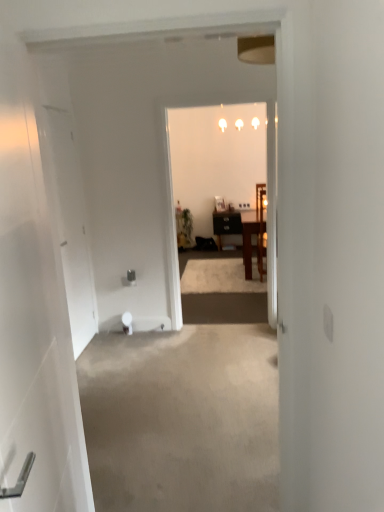
Identify the location of white matte door at left, the 2th door positioned from the front. [69, 202].

Measure the distance between point (17, 46) and camera.

They are 4.37 feet apart.

At what (x,y) coordinates should I click in order to perform the action: click on wooden chair at center, the 2th chair positioned from the back. Please return your answer as a coordinate pair (x, y). This screenshot has width=384, height=512. Looking at the image, I should click on (261, 228).

Image resolution: width=384 pixels, height=512 pixels. What do you see at coordinates (184, 228) in the screenshot?
I see `green matte houseplant at center` at bounding box center [184, 228].

Find the location of a particular element. This screenshot has height=512, width=384. white matte door at left, the second door in the right-to-left sequence is located at coordinates (69, 202).

Does green matte houseplant at center have a greater width compared to wooden chair at center, the 2th chair positioned from the back?

No, green matte houseplant at center is not wider than wooden chair at center, the 2th chair positioned from the back.

From a real-world perspective, which object rests below the other?

green matte houseplant at center, from a real-world perspective.

Considering the relative sizes of green matte houseplant at center and wooden chair at center, the first chair from the front, in the image provided, is green matte houseplant at center bigger than wooden chair at center, the first chair from the front,?

Incorrect, green matte houseplant at center is not larger than wooden chair at center, the first chair from the front.

From the picture: Which object is closer to the camera, green matte houseplant at center or wooden chair at center, the 2th chair positioned from the back?

wooden chair at center, the 2th chair positioned from the back, is in front.

Can we say green matte houseplant at center lies outside white glossy light fixture at upper center?

Yes, green matte houseplant at center is not within white glossy light fixture at upper center.

Considering the sizes of objects green matte houseplant at center and white glossy light fixture at upper center in the image provided, who is shorter, green matte houseplant at center or white glossy light fixture at upper center?

Standing shorter between the two is green matte houseplant at center.

From a real-world perspective, between green matte houseplant at center and white glossy light fixture at upper center, who is vertically higher?

white glossy light fixture at upper center is physically above.

Is green matte houseplant at center looking in the opposite direction of white glossy light fixture at upper center?

No, white glossy light fixture at upper center is not at the back of green matte houseplant at center.

Can you tell me how much white glossy door at left, the first door viewed from the right, and white matte door at left, the 2th door positioned from the front, differ in facing direction?

11.4 degrees.

Is white glossy door at left, the first door viewed from the right, facing towards white matte door at left, the 2th door positioned from the front?

No, white glossy door at left, the first door viewed from the right, does not turn towards white matte door at left, the 2th door positioned from the front.

Identify the location of door located above the white glossy door at left, which is counted as the 1th door, starting from the front (from the image's perspective). (69, 202).

How much distance is there between white glossy door at left, which is counted as the 1th door, starting from the front, and white matte door at left, the 2th door positioned from the front?

white glossy door at left, which is counted as the 1th door, starting from the front, and white matte door at left, the 2th door positioned from the front, are 1.90 meters apart from each other.

From the picture: Who is shorter, white glossy door at left, positioned as the second door in back-to-front order, or white glossy light fixture at upper center?

white glossy light fixture at upper center.

Is white glossy door at left, the 2th door in the left-to-right sequence, wider than white glossy light fixture at upper center?

Incorrect, the width of white glossy door at left, the 2th door in the left-to-right sequence, does not surpass that of white glossy light fixture at upper center.

Is white glossy door at left, the first door viewed from the right, looking in the opposite direction of white glossy light fixture at upper center?

white glossy door at left, the first door viewed from the right, does not have its back to white glossy light fixture at upper center.

Where is `lamp above the white glossy door at left, the first door viewed from the right (from the image's perspective)`? lamp above the white glossy door at left, the first door viewed from the right (from the image's perspective) is located at coordinates (222, 124).

Is wooden chair at center, the first chair from the front, in contact with white matte door at left, the second door in the right-to-left sequence?

No, wooden chair at center, the first chair from the front, is not beside white matte door at left, the second door in the right-to-left sequence.

Is point (259, 215) in front of point (62, 247)?

That is False.

Is wooden chair at center, the first chair from the front, bigger or smaller than white matte door at left, the second door in the right-to-left sequence?

wooden chair at center, the first chair from the front, is bigger than white matte door at left, the second door in the right-to-left sequence.

From the image's perspective, is wooden chair at center, the 2th chair positioned from the back, located above white matte door at left, the second door in the right-to-left sequence?

Correct, wooden chair at center, the 2th chair positioned from the back, appears higher than white matte door at left, the second door in the right-to-left sequence, in the image.

Between wooden chair at center, the 2th chair positioned from the back, and green matte houseplant at center, which one has more height?

wooden chair at center, the 2th chair positioned from the back, is taller.

Does wooden chair at center, the first chair from the front, appear on the left side of green matte houseplant at center?

No.

From the image's perspective, is wooden chair at center, the 2th chair positioned from the back, beneath green matte houseplant at center?

Yes.

Is green matte houseplant at center at the back of white glossy light fixture at upper center?

No.

From a real-world perspective, who is located lower, white glossy light fixture at upper center or green matte houseplant at center?

In real-world perspective, green matte houseplant at center is lower.

Considering the relative positions of white glossy light fixture at upper center and green matte houseplant at center in the image provided, is white glossy light fixture at upper center to the left or to the right of green matte houseplant at center?

In the image, white glossy light fixture at upper center appears on the right side of green matte houseplant at center.

I want to click on houseplant above the wooden chair at center, the 2th chair positioned from the back (from the image's perspective), so click(184, 228).

Locate an element on the screen. lamp on the right of the green matte houseplant at center is located at coordinates (222, 124).

Based on their spatial positions, is white glossy light fixture at upper center or white matte door at left, the second door in the right-to-left sequence, closer to green matte houseplant at center?

white glossy light fixture at upper center is closer to green matte houseplant at center.

Estimate the real-world distances between objects in this image. Which object is closer to white matte door at left, marked as the 1th door in a left-to-right arrangement, white glossy door at left, the first door viewed from the right, or green matte houseplant at center?

The object closer to white matte door at left, marked as the 1th door in a left-to-right arrangement, is white glossy door at left, the first door viewed from the right.

Consider the image. Considering their positions, is white glossy light fixture at upper center positioned closer to green matte houseplant at center than white glossy door at left, the first door viewed from the right?

Based on the image, white glossy light fixture at upper center appears to be nearer to green matte houseplant at center.

In the scene shown: When comparing their distances from white matte door at left, the 2th door positioned from the front, does green matte houseplant at center or wooden chair at center, the 2th chair positioned from the back, seem further?

green matte houseplant at center.

Considering their positions, is wooden chair at center, which is the first chair in back-to-front order, positioned closer to green matte houseplant at center than white glossy light fixture at upper center?

Among the two, wooden chair at center, which is the first chair in back-to-front order, is located nearer to green matte houseplant at center.

Which object lies nearer to the anchor point white glossy door at left, the 2th door in the left-to-right sequence, wooden chair at center, the 2th chair positioned from the back, or white matte door at left, marked as the 1th door in a left-to-right arrangement?

white matte door at left, marked as the 1th door in a left-to-right arrangement.

Which object lies further to the anchor point white glossy door at left, positioned as the second door in back-to-front order, green matte houseplant at center or white glossy light fixture at upper center?

white glossy light fixture at upper center.

Looking at this image, looking at the image, which one is located closer to white glossy light fixture at upper center, wooden chair at center, the 2th chair positioned from the back, or white glossy door at left, the 2th door in the left-to-right sequence?

The object closer to white glossy light fixture at upper center is wooden chair at center, the 2th chair positioned from the back.

Where is `chair between white glossy light fixture at upper center and wooden chair at center, the 2th chair viewed from the front, in the vertical direction`? The image size is (384, 512). chair between white glossy light fixture at upper center and wooden chair at center, the 2th chair viewed from the front, in the vertical direction is located at coordinates (261, 228).

What are the coordinates of `chair located between white matte door at left, placed as the first door when sorted from back to front, and wooden chair at center, the 2th chair viewed from the front, in the depth direction` in the screenshot? It's located at (261, 228).

Find the location of a particular element. This screenshot has height=512, width=384. lamp positioned between white matte door at left, marked as the 1th door in a left-to-right arrangement, and green matte houseplant at center from near to far is located at coordinates (222, 124).

The height and width of the screenshot is (512, 384). What are the coordinates of `lamp between white glossy door at left, which is counted as the 1th door, starting from the front, and green matte houseplant at center in the front-back direction` in the screenshot? It's located at (222, 124).